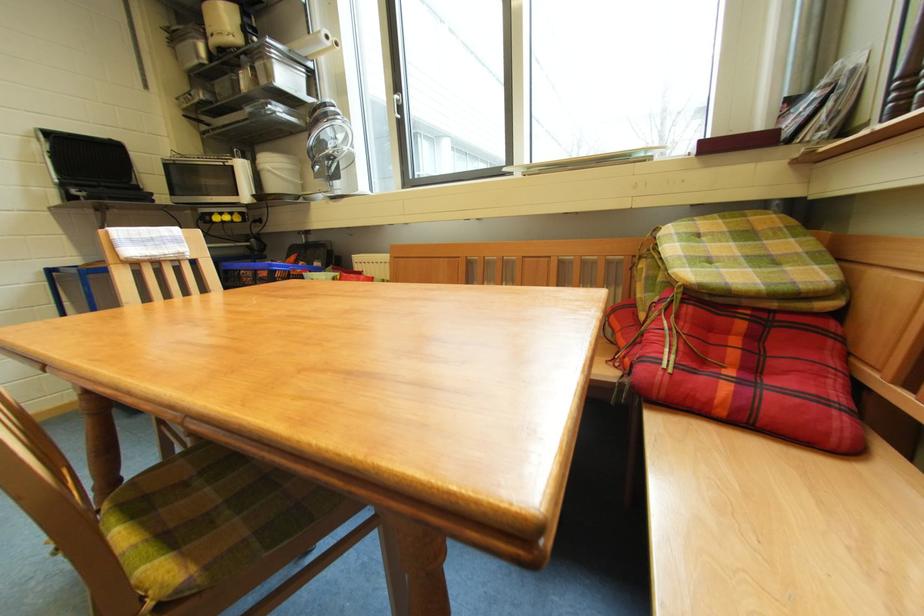
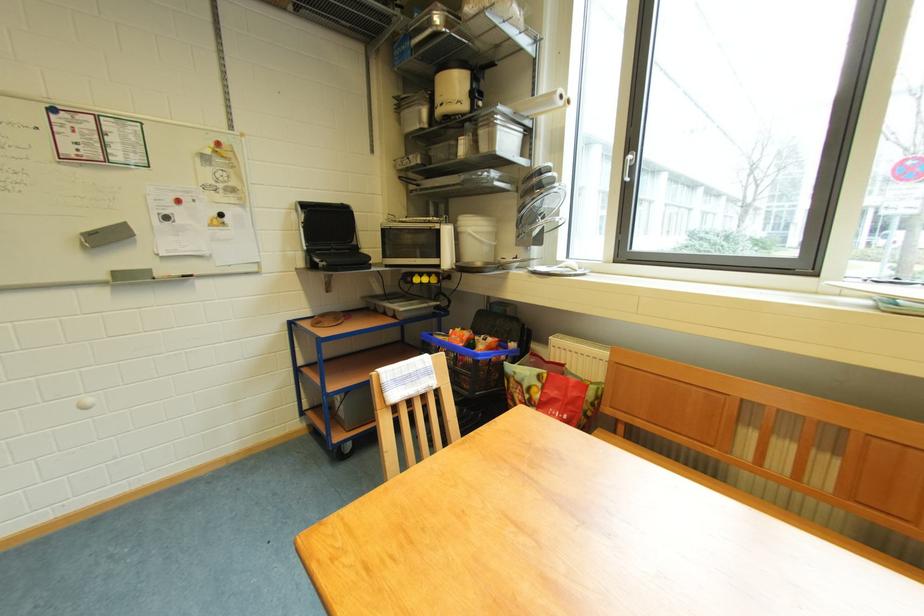
Where in the second image is the point corresponding to point (153, 238) from the first image?

(412, 376)